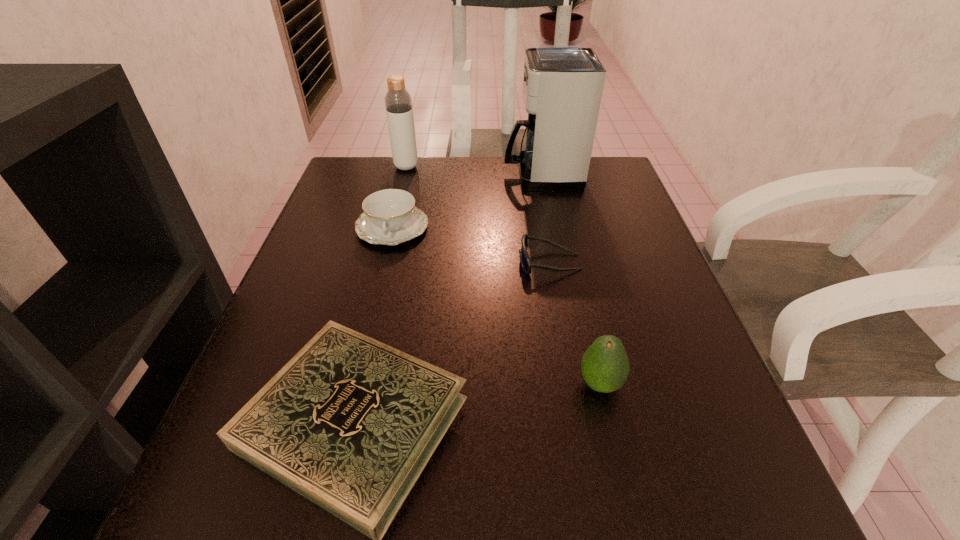
Where is `the tallest object`? the tallest object is located at coordinates (562, 84).

The height and width of the screenshot is (540, 960). In order to click on the fifth shortest object in this screenshot , I will do `click(398, 103)`.

Where is `avocado`? The height and width of the screenshot is (540, 960). avocado is located at coordinates (605, 367).

You are a GUI agent. You are given a task and a screenshot of the screen. Output one action in this format:
    pyautogui.click(x=<x>, y=<y>)
    Task: Click on the chinaware
    Image resolution: width=960 pixels, height=540 pixels.
    Given the screenshot: What is the action you would take?
    pyautogui.click(x=390, y=217)

Locate an element on the screen. sunglasses is located at coordinates (525, 261).

The width and height of the screenshot is (960, 540). In order to click on vacant space located on the front panel of the tallest object in this screenshot , I will do `click(463, 174)`.

Locate an element on the screen. This screenshot has height=540, width=960. vacant space located 0.400m on the front panel of the tallest object is located at coordinates (354, 174).

At what (x,y) coordinates should I click in order to perform the action: click on free location located 0.080m on the front panel of the tallest object. Please return your answer as a coordinate pair (x, y). Looking at the image, I should click on (474, 174).

You are a GUI agent. You are given a task and a screenshot of the screen. Output one action in this format:
    pyautogui.click(x=<x>, y=<y>)
    Task: Click on the free point located on the front of the second tallest object
    The image size is (960, 540).
    Given the screenshot: What is the action you would take?
    pyautogui.click(x=382, y=267)

The width and height of the screenshot is (960, 540). Find the location of `blank area located on the front of the third tallest object`. blank area located on the front of the third tallest object is located at coordinates pos(626,500).